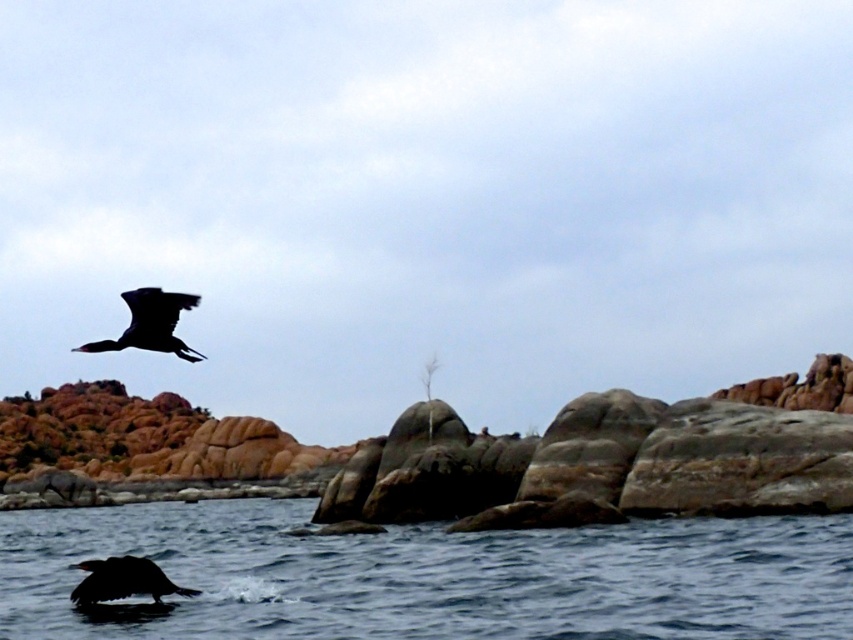
You are standing at the point with coordinates point (131, 328) and want to walk towards the point with coordinates point (86, 588). Which direction should you move?

You should move towards the point (86, 588), which is behind point (131, 328) since point (131, 328) is in front of point (86, 588).

You are standing on the rocky shore and see the smooth dark blue water at lower center and the silhouette glossy bird at lower left. Which object is closer to you?

The smooth dark blue water at lower center is closer to you because it is in front of the silhouette glossy bird at lower left.

You are a photographer trying to capture the silhouette glossy bird at lower left and the smooth dark blue water at lower center in the same frame. Based on their positions, will the bird appear to be flying over or under the water in the photo?

The smooth dark blue water at lower center is positioned under the silhouette glossy bird at lower left, so the bird will appear to be flying over the water in the photo.